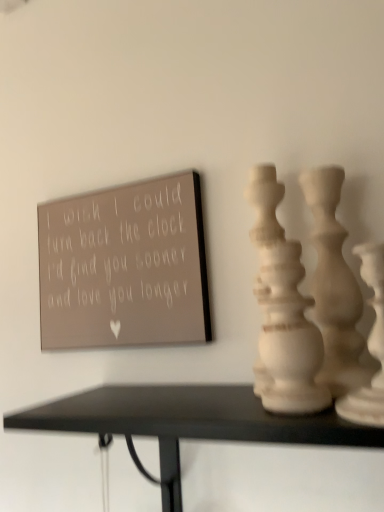
Question: Looking at the image, does white matte vase at right, acting as the third vase starting from the back, seem bigger or smaller compared to white matte vase at right, which is the first vase in back-to-front order?

Choices:
 (A) small
 (B) big

Answer: (B)

Question: Considering the relative positions of white matte vase at right, acting as the third vase starting from the back, and white matte vase at right, which is the first vase in back-to-front order, in the image provided, is white matte vase at right, acting as the third vase starting from the back, to the left or to the right of white matte vase at right, which is the first vase in back-to-front order,?

Choices:
 (A) right
 (B) left

Answer: (A)

Question: Estimate the real-world distances between objects in this image. Which object is closer to the matte gray sign at upper left?

Choices:
 (A) white matte vase at right, acting as the third vase starting from the back
 (B) white matte vase at right, which is the first vase in back-to-front order
 (C) white matte vase at center, which is the second vase from back to front

Answer: (C)

Question: Which of these objects is positioned farthest from the matte gray sign at upper left?

Choices:
 (A) white matte vase at right, acting as the third vase starting from the back
 (B) white matte vase at right, the third vase when ordered from front to back
 (C) white matte vase at center, which is the second vase from back to front

Answer: (A)